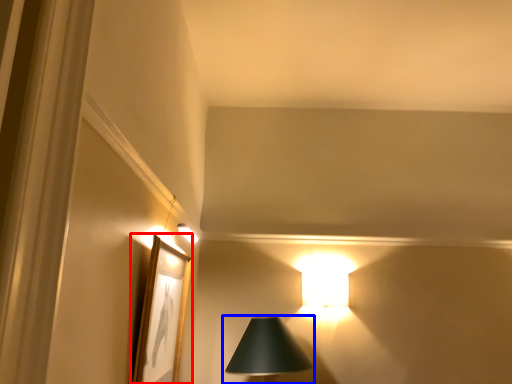
Question: Which of the following is the farthest to the observer, picture frame (highlighted by a red box) or lamp (highlighted by a blue box)?

Choices:
 (A) picture frame
 (B) lamp

Answer: (B)